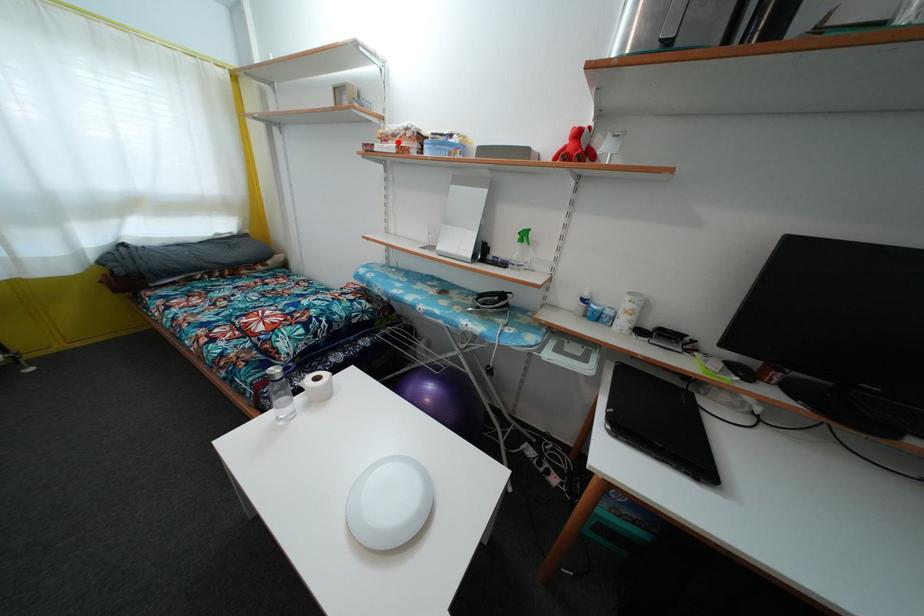
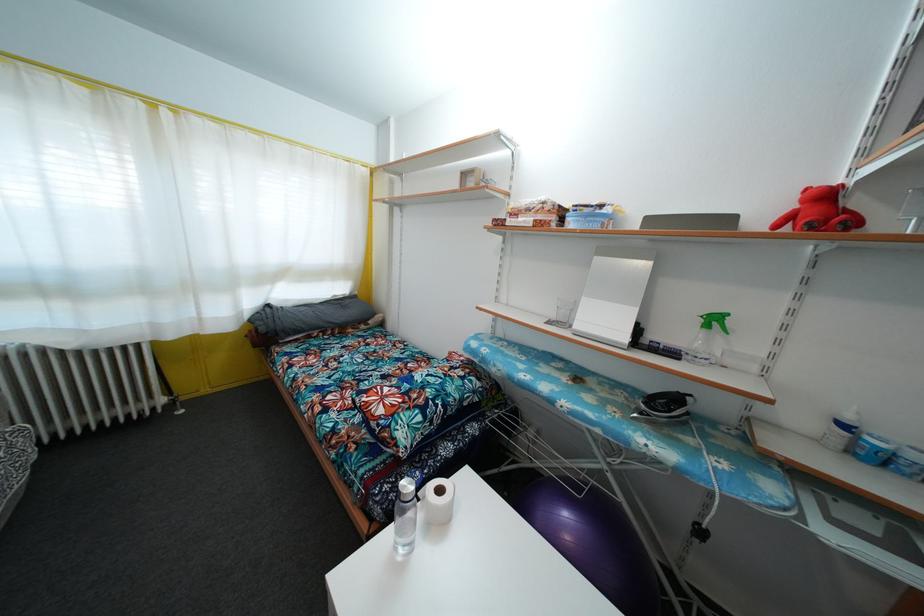
Locate, in the second image, the point that corresponds to the highlighted location in the first image.

(531, 216)